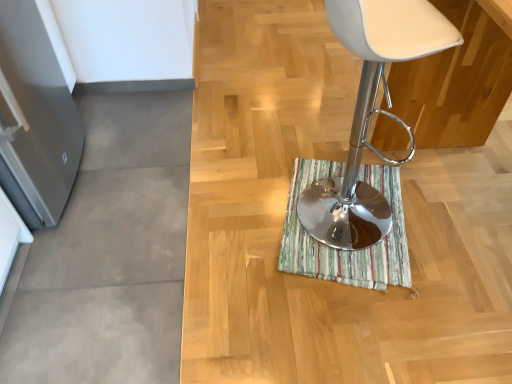
Question: Considering the positions of striped fabric bath mat at center and white plastic stool at center in the image, is striped fabric bath mat at center wider or thinner than white plastic stool at center?

Choices:
 (A) thin
 (B) wide

Answer: (B)

Question: In the image, is striped fabric bath mat at center positioned in front of or behind white plastic stool at center?

Choices:
 (A) behind
 (B) front

Answer: (A)

Question: From the image's perspective, is striped fabric bath mat at center positioned above or below white plastic stool at center?

Choices:
 (A) below
 (B) above

Answer: (A)

Question: Considering their positions, is white plastic stool at center located in front of or behind striped fabric bath mat at center?

Choices:
 (A) front
 (B) behind

Answer: (A)

Question: Considering the positions of point (372, 67) and point (397, 177), is point (372, 67) closer or farther from the camera than point (397, 177)?

Choices:
 (A) farther
 (B) closer

Answer: (B)

Question: Is white plastic stool at center situated inside striped fabric bath mat at center or outside?

Choices:
 (A) inside
 (B) outside

Answer: (B)

Question: From a real-world perspective, is white plastic stool at center above or below striped fabric bath mat at center?

Choices:
 (A) above
 (B) below

Answer: (A)